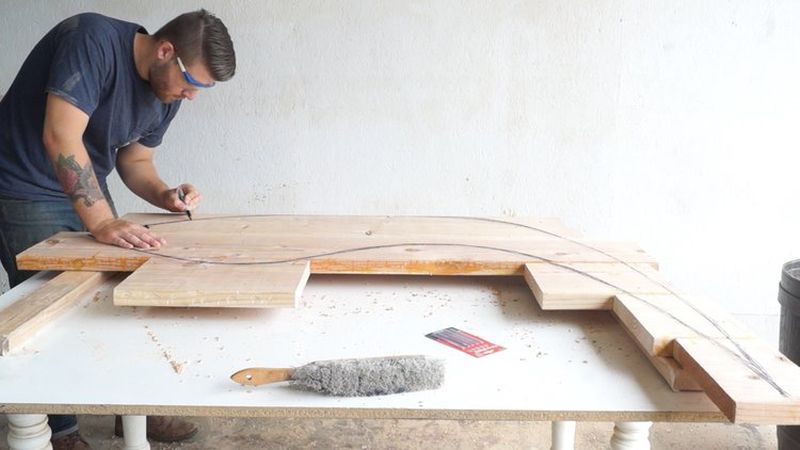
Locate an element on the screen. This screenshot has height=450, width=800. table is located at coordinates (545, 397).